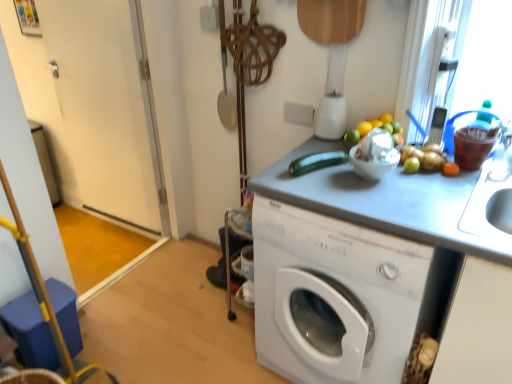
At what (x,y) coordinates should I click in order to perform the action: click on free space to the back side of green matte zucchini at center. Please return your answer as a coordinate pair (x, y). Looking at the image, I should click on (316, 152).